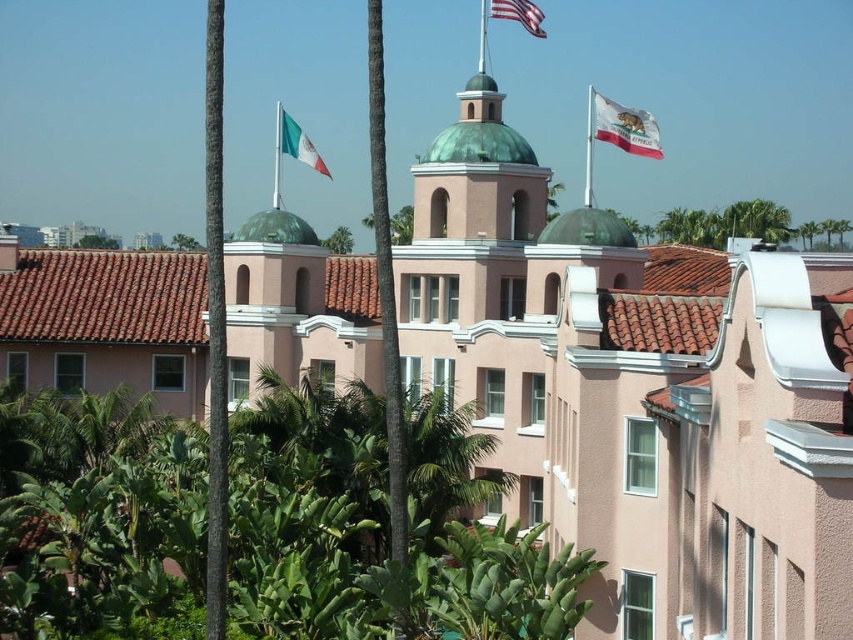
Question: Which point appears farthest from the camera in this image?

Choices:
 (A) (508, 10)
 (B) (279, 116)

Answer: (B)

Question: Is white fabric flag at upper right behind green fabric flag at upper center?

Choices:
 (A) no
 (B) yes

Answer: (A)

Question: Which of the following is the closest to the observer?

Choices:
 (A) (297, 147)
 (B) (624, 122)
 (C) (496, 4)

Answer: (B)

Question: Is white fabric flag at upper right above american flag at upper center?

Choices:
 (A) yes
 (B) no

Answer: (B)

Question: Can you confirm if white fabric flag at upper right is bigger than american flag at upper center?

Choices:
 (A) yes
 (B) no

Answer: (B)

Question: Which object appears closest to the camera in this image?

Choices:
 (A) green fabric flag at upper center
 (B) white fabric flag at upper right

Answer: (B)